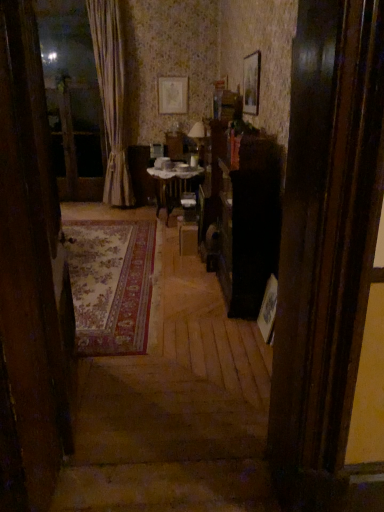
Question: From a real-world perspective, does silky beige curtain at left sit lower than wooden picture frame at upper center, which is counted as the second picture frame, starting from the back?

Choices:
 (A) yes
 (B) no

Answer: (A)

Question: From a real-world perspective, is silky beige curtain at left on wooden picture frame at upper center, which is counted as the second picture frame, starting from the back?

Choices:
 (A) no
 (B) yes

Answer: (A)

Question: Would you say silky beige curtain at left contains wooden picture frame at upper center, which is counted as the second picture frame, starting from the back?

Choices:
 (A) yes
 (B) no

Answer: (B)

Question: Is silky beige curtain at left beside wooden picture frame at upper center, the first picture frame in the front-to-back sequence?

Choices:
 (A) no
 (B) yes

Answer: (A)

Question: From the image's perspective, does silky beige curtain at left appear lower than wooden picture frame at upper center, which is the second picture frame from left to right?

Choices:
 (A) yes
 (B) no

Answer: (B)

Question: From a real-world perspective, is wooden table at center positioned above or below matte paper picture frame at upper center, which is the 1th picture frame in back-to-front order?

Choices:
 (A) below
 (B) above

Answer: (A)

Question: In terms of size, does wooden table at center appear bigger or smaller than matte paper picture frame at upper center, the 2th picture frame from the front?

Choices:
 (A) small
 (B) big

Answer: (B)

Question: From the image's perspective, is wooden table at center positioned above or below matte paper picture frame at upper center, arranged as the second picture frame when ordered from the bottom?

Choices:
 (A) above
 (B) below

Answer: (B)

Question: Considering the relative positions of wooden table at center and matte paper picture frame at upper center, acting as the first picture frame starting from the left, in the image provided, is wooden table at center to the left or to the right of matte paper picture frame at upper center, acting as the first picture frame starting from the left,?

Choices:
 (A) left
 (B) right

Answer: (B)

Question: From a real-world perspective, is carpeted rug at left positioned above or below silky beige curtain at left?

Choices:
 (A) above
 (B) below

Answer: (B)

Question: Is carpeted rug at left to the left or to the right of silky beige curtain at left in the image?

Choices:
 (A) right
 (B) left

Answer: (A)

Question: Considering the positions of carpeted rug at left and silky beige curtain at left in the image, is carpeted rug at left wider or thinner than silky beige curtain at left?

Choices:
 (A) wide
 (B) thin

Answer: (B)

Question: In terms of height, does carpeted rug at left look taller or shorter compared to silky beige curtain at left?

Choices:
 (A) tall
 (B) short

Answer: (B)

Question: Looking at the image, does wooden picture frame at upper center, which ranks as the 1th picture frame in bottom-to-top order, seem bigger or smaller compared to silky beige curtain at left?

Choices:
 (A) big
 (B) small

Answer: (B)

Question: Is wooden picture frame at upper center, the second picture frame from the top, wider or thinner than silky beige curtain at left?

Choices:
 (A) thin
 (B) wide

Answer: (A)